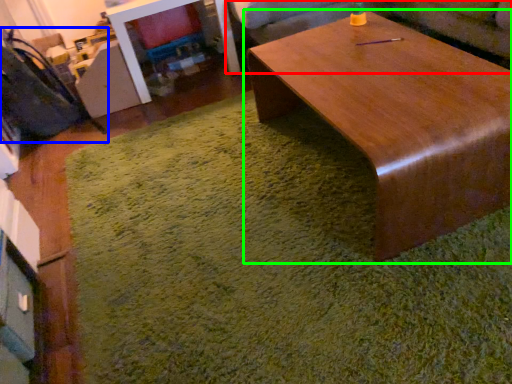
Question: Which object is the closest to the couch (highlighted by a red box)? Choose among these: swivel chair (highlighted by a blue box) or coffee table (highlighted by a green box).

Choices:
 (A) swivel chair
 (B) coffee table

Answer: (B)